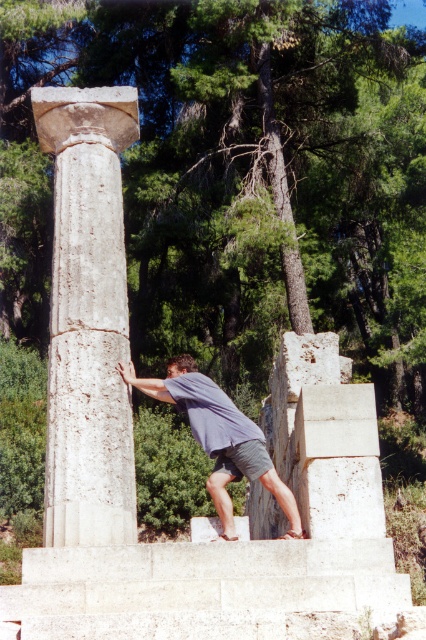
Is white marble column at left below gray fabric shirt at center?

No.

Does white marble column at left lie in front of gray fabric shirt at center?

Yes, white marble column at left is closer to the viewer.

Does point (57, 352) lie behind point (195, 376)?

No, (57, 352) is closer to viewer.

I want to click on white marble column at left, so click(88, 317).